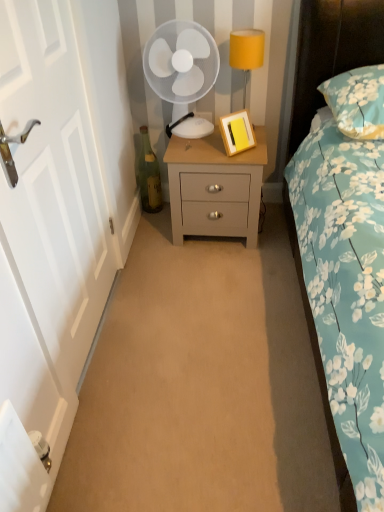
Locate an element on the screen. This screenshot has height=512, width=384. free space in front of light gray wood nightstand at center is located at coordinates (218, 275).